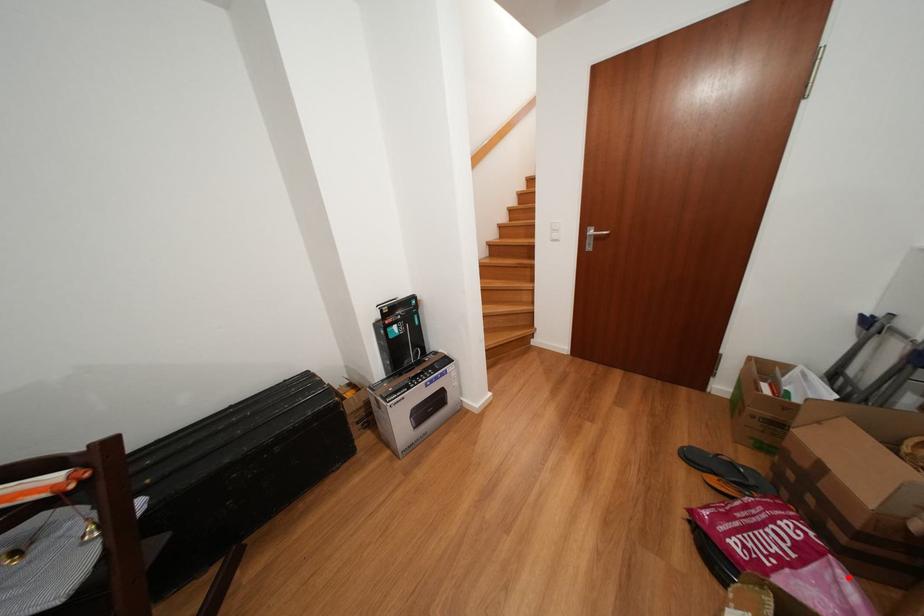
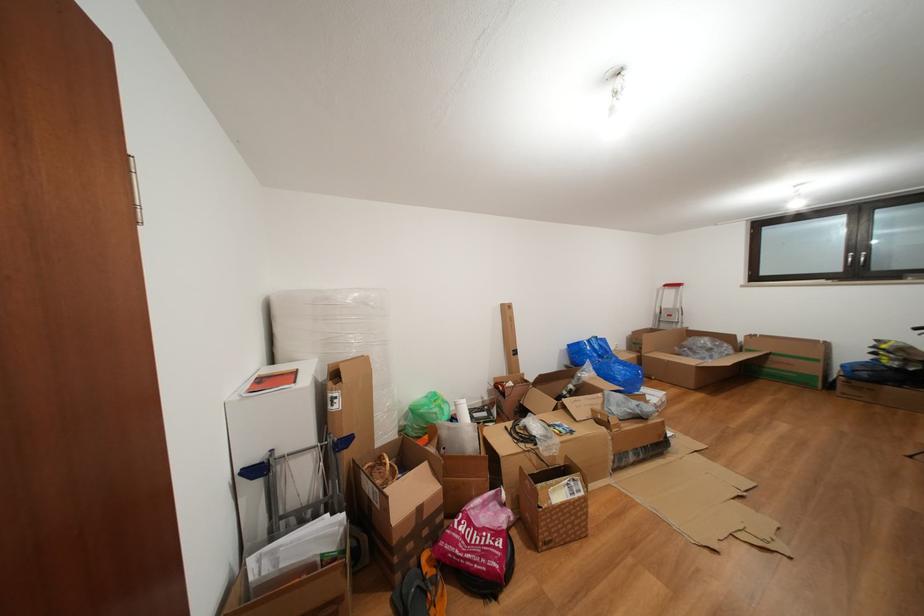
Question: I am providing you with two images of the same scene from different viewpoints. A red point is shown in image1. For the corresponding object point in image2, is it positioned nearer or farther from the camera?

Choices:
 (A) Nearer
 (B) Farther

Answer: (A)